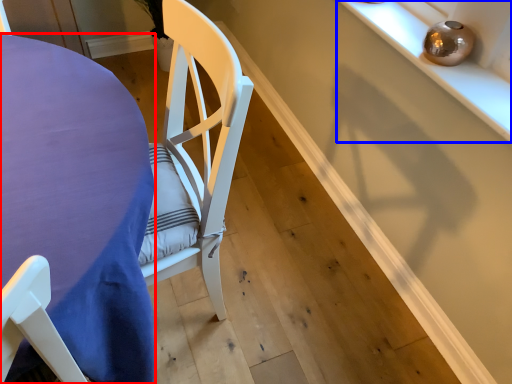
Question: Which object is further to the camera taking this photo, table (highlighted by a red box) or shelf (highlighted by a blue box)?

Choices:
 (A) table
 (B) shelf

Answer: (B)